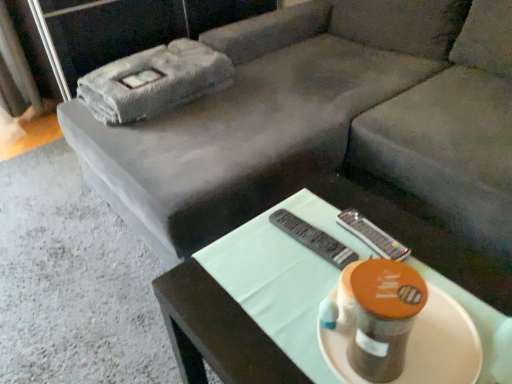
Question: Is matte white platter at center to the left or to the right of black plastic remote at center in the image?

Choices:
 (A) right
 (B) left

Answer: (A)

Question: Considering the positions of point (440, 364) and point (307, 233), is point (440, 364) closer or farther from the camera than point (307, 233)?

Choices:
 (A) closer
 (B) farther

Answer: (A)

Question: Based on their relative distances, which object is farther from the matte black table at center?

Choices:
 (A) matte white platter at center
 (B) gray fabric couch at center
 (C) black plastic remote at center

Answer: (B)

Question: Estimate the real-world distances between objects in this image. Which object is farther from the black plastic remote at center?

Choices:
 (A) gray fabric couch at center
 (B) matte white platter at center
 (C) matte black table at center

Answer: (A)